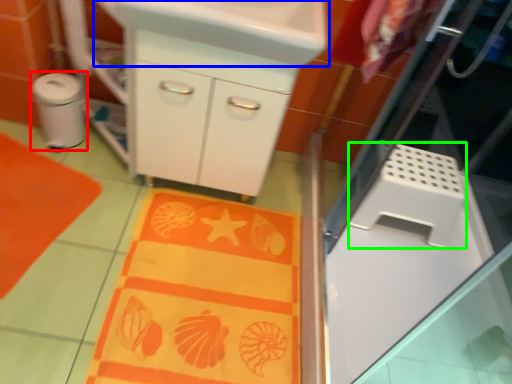
Question: Considering the real-world distances, which object is closest to appliance (highlighted by a red box)? sink (highlighted by a blue box) or appliance (highlighted by a green box).

Choices:
 (A) sink
 (B) appliance

Answer: (A)